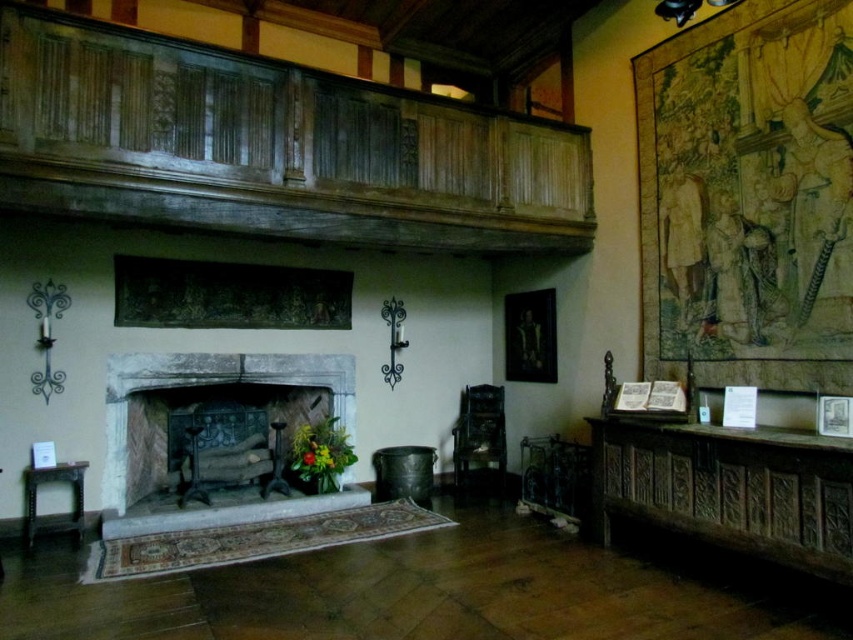
Question: Which point is closer to the camera?

Choices:
 (A) stone fireplace at center
 (B) weathered wood mantle at upper center

Answer: (B)

Question: Is weathered wood mantle at upper center above dark wood carved chest at lower right?

Choices:
 (A) yes
 (B) no

Answer: (A)

Question: Which point is closer to the camera taking this photo?

Choices:
 (A) pyautogui.click(x=201, y=362)
 (B) pyautogui.click(x=550, y=120)

Answer: (A)

Question: Which object appears farthest from the camera in this image?

Choices:
 (A) dark wood carved chest at lower right
 (B) weathered wood mantle at upper center

Answer: (B)

Question: Can you confirm if weathered wood mantle at upper center is positioned above stone fireplace at center?

Choices:
 (A) no
 (B) yes

Answer: (B)

Question: Does dark wood carved chest at lower right appear on the left side of stone fireplace at center?

Choices:
 (A) no
 (B) yes

Answer: (A)